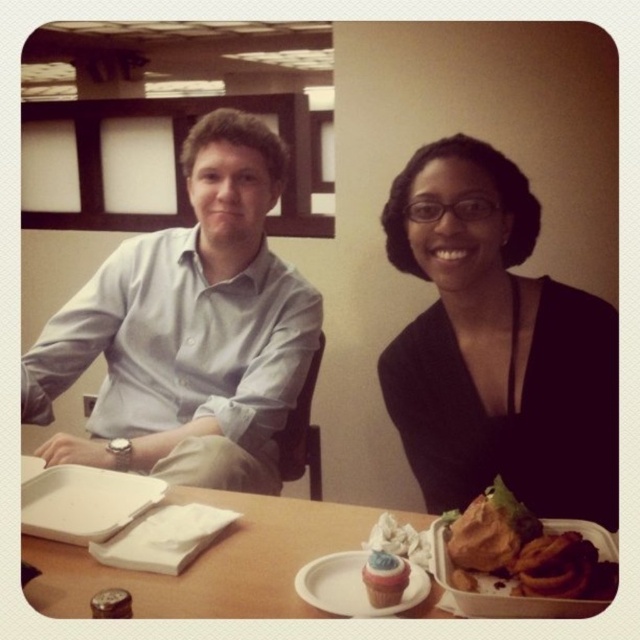
You are standing at the origin point of the coordinate system in the image. The white paper plate at center is located at point (349, 586). If you want to move towards the white paper plate at center, which direction should you move in terms of the coordinate system?

To move towards the white paper plate at center located at point (349, 586) from the origin, you should move in the positive x and y directions since both coordinates are greater than zero.

You are a photographer positioned behind the table. You want to take a photo of the smooth white cupcake at lower center without the light blue shirt at center blocking the view. Is this possible?

The light blue shirt at center is further to the viewer than the smooth white cupcake at lower center, so the shirt will block the cupcake from view. You cannot take a photo of the smooth white cupcake at lower center without the light blue shirt at center blocking the view.

You are a fashion designer who wants to display a dress on a table. Looking at the image, can you confirm if the black matte dress at center is currently placed on top of the wooden table at center?

The black matte dress at center is positioned over wooden table at center, so yes, it is currently placed on top of the wooden table at center.